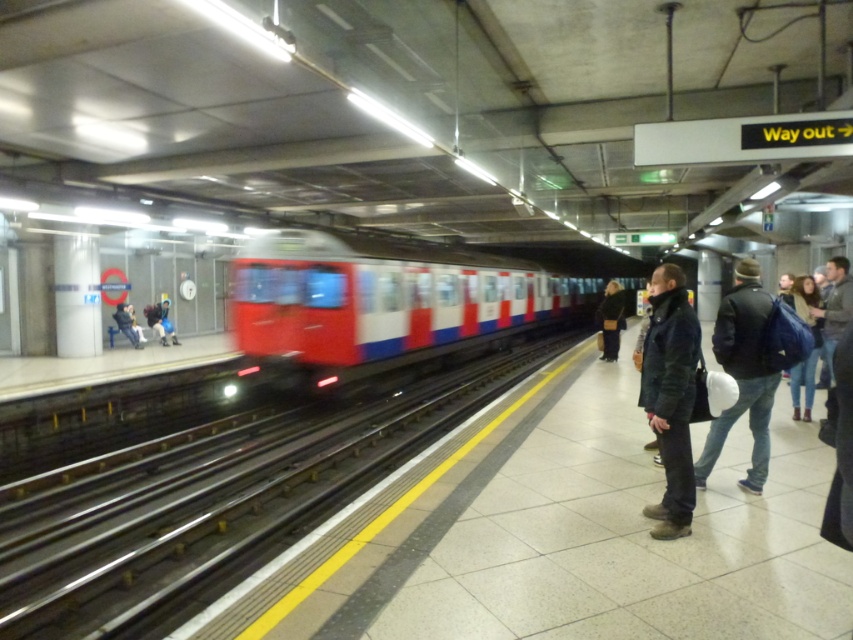
Question: Among these points, which one is nearest to the camera?

Choices:
 (A) (758, 342)
 (B) (469, 348)
 (C) (386, 403)
 (D) (126, 330)

Answer: (A)

Question: Does metallic train track at center appear over dark blue jacket at right?

Choices:
 (A) yes
 (B) no

Answer: (B)

Question: Which point is closer to the camera?

Choices:
 (A) (689, 512)
 (B) (125, 621)
 (C) (598, 317)

Answer: (A)

Question: Among these points, which one is farthest from the camera?

Choices:
 (A) (786, 296)
 (B) (753, 284)
 (C) (41, 486)

Answer: (A)

Question: Is red/white/blue metal train at center to the right of dark blue jacket at right from the viewer's perspective?

Choices:
 (A) yes
 (B) no

Answer: (B)

Question: Does denim jacket at right have a larger size compared to dark blue jacket at right?

Choices:
 (A) no
 (B) yes

Answer: (B)